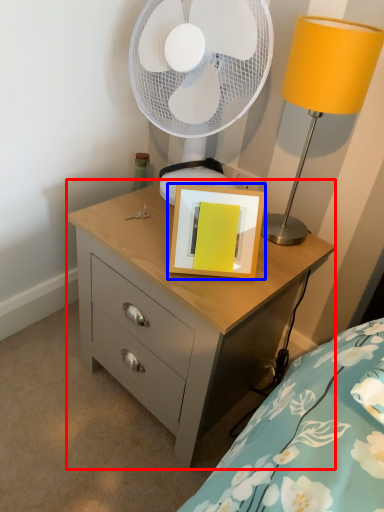
Question: Which of the following is the farthest to the observer, chest of drawers (highlighted by a red box) or picture frame (highlighted by a blue box)?

Choices:
 (A) chest of drawers
 (B) picture frame

Answer: (B)